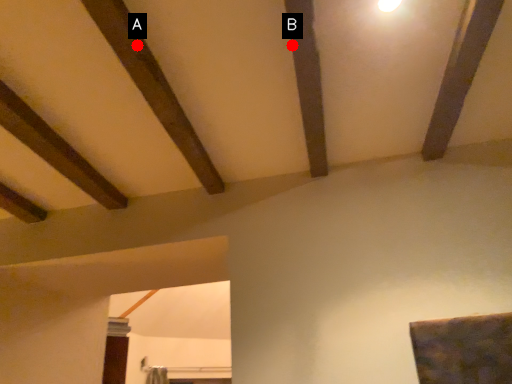
Question: Two points are circled on the image, labeled by A and B beside each circle. Which point is closer to the camera?

Choices:
 (A) A is closer
 (B) B is closer

Answer: (A)